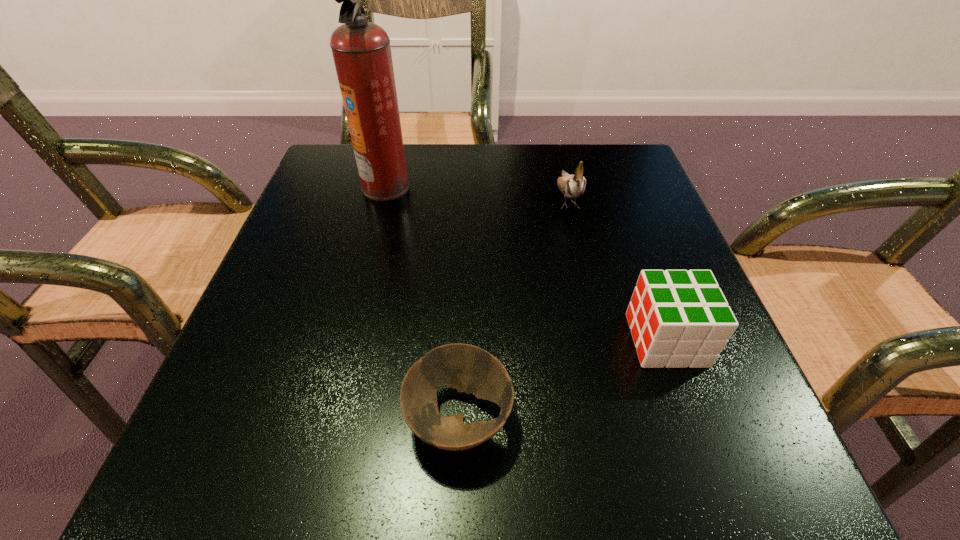
Image resolution: width=960 pixels, height=540 pixels. Find the location of `vacant position located 0.100m on the red face of the rightmost object`. vacant position located 0.100m on the red face of the rightmost object is located at coordinates [568, 340].

Identify the location of vacant position located 0.290m on the red face of the rightmost object. (445, 340).

Image resolution: width=960 pixels, height=540 pixels. Identify the location of free location located 0.150m on the red face of the rightmost object. (536, 340).

The image size is (960, 540). Find the location of `vacant space positioned 0.310m on the right of the shortest object`. vacant space positioned 0.310m on the right of the shortest object is located at coordinates (742, 418).

At what (x,y) coordinates should I click in order to perform the action: click on fire extinguisher at the far edge. Please return your answer as a coordinate pair (x, y). The height and width of the screenshot is (540, 960). Looking at the image, I should click on (361, 50).

Find the location of a particular element. This screenshot has width=960, height=540. bird located in the far edge section of the desktop is located at coordinates (572, 186).

Find the location of a particular element. This screenshot has width=960, height=540. object positioned at the near edge is located at coordinates (469, 369).

Identify the location of object present at the left edge. (361, 50).

Where is `bird located in the right edge section of the desktop`? The image size is (960, 540). bird located in the right edge section of the desktop is located at coordinates (572, 186).

At what (x,y) coordinates should I click in order to perform the action: click on cube at the right edge. Please return your answer as a coordinate pair (x, y). Looking at the image, I should click on (678, 318).